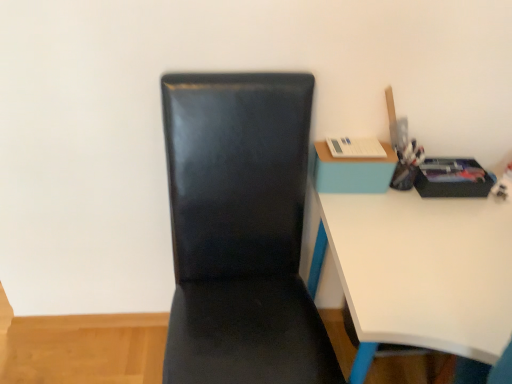
Question: Should I look upward or downward to see white glossy desk at right?

Choices:
 (A) down
 (B) up

Answer: (A)

Question: Does blue matte table at upper right have a larger size compared to black leather chair at center?

Choices:
 (A) no
 (B) yes

Answer: (A)

Question: Would you say black leather chair at center is part of blue matte table at upper right's contents?

Choices:
 (A) no
 (B) yes

Answer: (A)

Question: Is blue matte table at upper right behind black leather chair at center?

Choices:
 (A) yes
 (B) no

Answer: (A)

Question: Are blue matte table at upper right and black leather chair at center making contact?

Choices:
 (A) no
 (B) yes

Answer: (A)

Question: From the image's perspective, is blue matte table at upper right located above black leather chair at center?

Choices:
 (A) no
 (B) yes

Answer: (B)

Question: Is blue matte table at upper right oriented away from black leather chair at center?

Choices:
 (A) yes
 (B) no

Answer: (B)

Question: From a real-world perspective, is white glossy desk at right located beneath blue matte table at upper right?

Choices:
 (A) no
 (B) yes

Answer: (B)

Question: Does white glossy desk at right have a greater width compared to blue matte table at upper right?

Choices:
 (A) yes
 (B) no

Answer: (A)

Question: Can you confirm if white glossy desk at right is thinner than blue matte table at upper right?

Choices:
 (A) no
 (B) yes

Answer: (A)

Question: Does white glossy desk at right come in front of blue matte table at upper right?

Choices:
 (A) no
 (B) yes

Answer: (B)

Question: Can blue matte table at upper right be found inside white glossy desk at right?

Choices:
 (A) yes
 (B) no

Answer: (B)

Question: Does white glossy desk at right have a smaller size compared to blue matte table at upper right?

Choices:
 (A) no
 (B) yes

Answer: (A)

Question: Is there a large distance between white glossy desk at right and black leather chair at center?

Choices:
 (A) yes
 (B) no

Answer: (B)